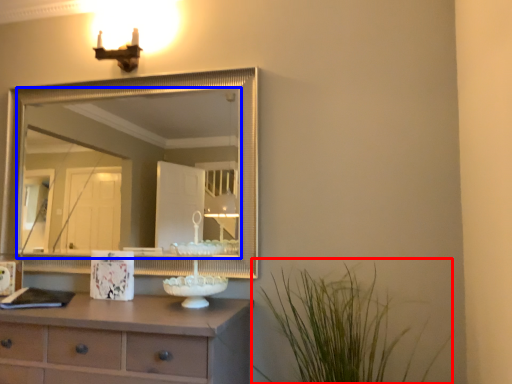
Question: Which point is further to the camera, plant (highlighted by a red box) or mirror (highlighted by a blue box)?

Choices:
 (A) plant
 (B) mirror

Answer: (B)